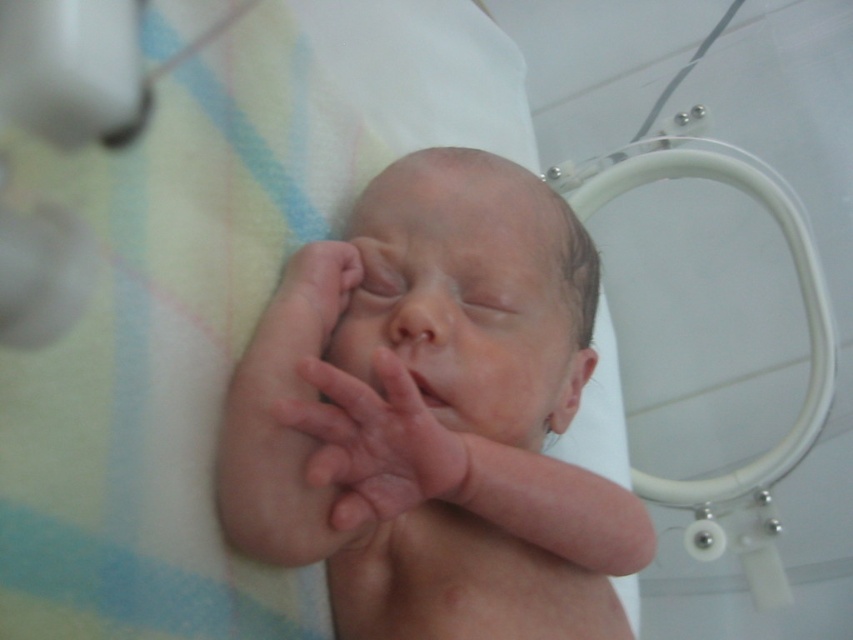
From the picture: You are a nurse in a hospital nursery. You need to check the baby in the incubator. The incubator has a transparent front panel that you can touch. The panel is 14 inches away from the camera. Is the smooth skin baby at center inside the incubator?

The smooth skin baby at center is 15.49 inches away from the camera, which is farther than the 14 inches distance of the incubator panel. This indicates that the smooth skin baby at center is likely behind the incubator panel and therefore inside the incubator.

You are a nurse checking on a newborn baby in the hospital. You notice the smooth skin baby at center and the pink smooth skin at center. How far apart are these two areas on the baby?

The smooth skin baby at center and the pink smooth skin at center are 3.20 inches apart from each other.